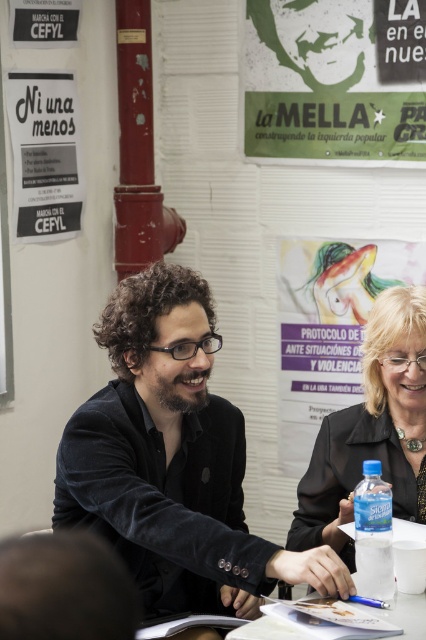
Is white paper poster at upper left above white paper at upper left?

No.

Who is more forward, (26, 164) or (74, 8)?

Point (26, 164) is in front.

Does point (25, 92) lie in front of point (60, 32)?

Yes, it is in front of point (60, 32).

What are the coordinates of `white paper poster at upper left` in the screenshot? It's located at (45, 154).

Does velvet black jacket at center have a smaller size compared to green paper poster at upper center?

No.

Does point (167, 531) lie in front of point (290, 150)?

Yes.

I want to click on velvet black jacket at center, so click(x=172, y=460).

Can you confirm if black leather jacket at right is smaller than white paper at upper left?

No, black leather jacket at right is not smaller than white paper at upper left.

Between point (313, 509) and point (60, 19), which one is positioned behind?

Point (60, 19)

Find the location of a particular element. The height and width of the screenshot is (640, 426). black leather jacket at right is located at coordinates (371, 429).